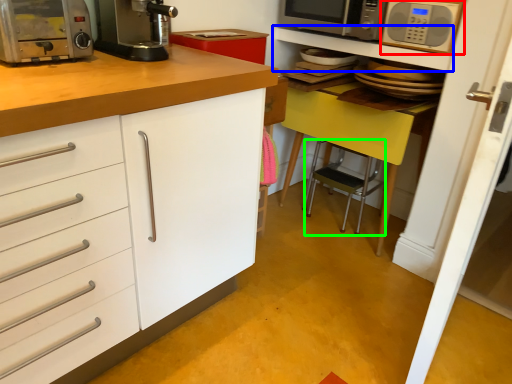
Question: Which is nearer to the microwave oven (highlighted by a red box)? shelf (highlighted by a blue box) or step stool (highlighted by a green box).

Choices:
 (A) shelf
 (B) step stool

Answer: (A)